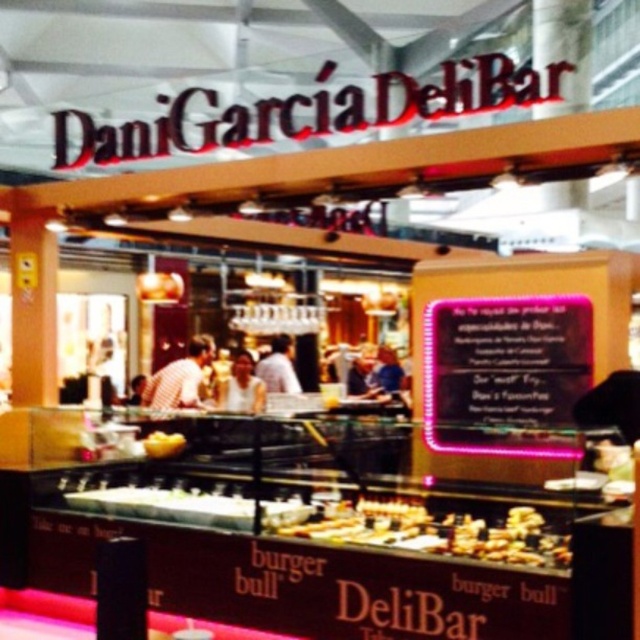
Question: Does white matte shirt at center have a greater width compared to yellow matte bread at lower left?

Choices:
 (A) yes
 (B) no

Answer: (A)

Question: Which of the following is the farthest from the observer?

Choices:
 (A) (442, 554)
 (B) (262, 392)
 (C) (292, 390)
 (D) (150, 436)

Answer: (C)

Question: Among these objects, which one is nearest to the camera?

Choices:
 (A) yellow matte bread at lower left
 (B) golden brown bread at center

Answer: (B)

Question: Which object is farther from the camera taking this photo?

Choices:
 (A) yellow matte bread at lower left
 (B) golden brown bread at center
 (C) white shirt at center

Answer: (C)

Question: Is white matte shirt at center in front of white shirt at center?

Choices:
 (A) yes
 (B) no

Answer: (A)

Question: Is golden brown bread at center below white matte shirt at center?

Choices:
 (A) no
 (B) yes

Answer: (B)